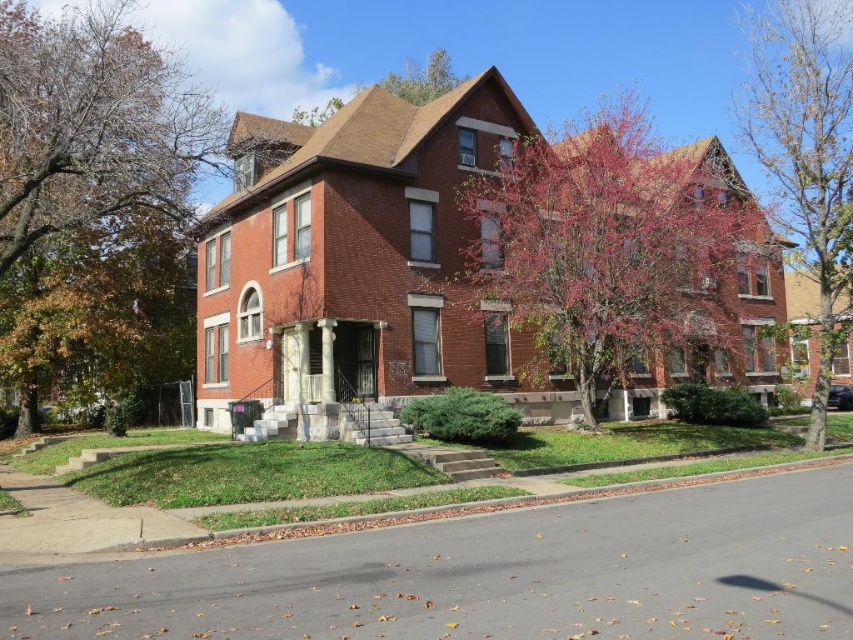
Does reddish-brown bark tree at center appear on the left side of green leafy tree at upper center?

In fact, reddish-brown bark tree at center is to the right of green leafy tree at upper center.

Which is above, reddish-brown bark tree at center or green leafy tree at upper center?

green leafy tree at upper center

Does point (631, 172) come closer to viewer compared to point (303, 113)?

Yes, it is in front of point (303, 113).

Identify the location of reddish-brown bark tree at center. Image resolution: width=853 pixels, height=640 pixels. (614, 252).

Who is taller, reddish-brown bark tree at center or smooth bark tree at right?

smooth bark tree at right is taller.

Is point (618, 168) closer to camera compared to point (808, 65)?

Yes, point (618, 168) is in front of point (808, 65).

What do you see at coordinates (614, 252) in the screenshot? The height and width of the screenshot is (640, 853). I see `reddish-brown bark tree at center` at bounding box center [614, 252].

I want to click on reddish-brown bark tree at center, so click(614, 252).

Looking at this image, can you confirm if smooth bark tree at right is positioned to the right of green leafy tree at upper center?

Indeed, smooth bark tree at right is positioned on the right side of green leafy tree at upper center.

Can you confirm if smooth bark tree at right is taller than green leafy tree at upper center?

Indeed, smooth bark tree at right has a greater height compared to green leafy tree at upper center.

The width and height of the screenshot is (853, 640). I want to click on smooth bark tree at right, so click(807, 156).